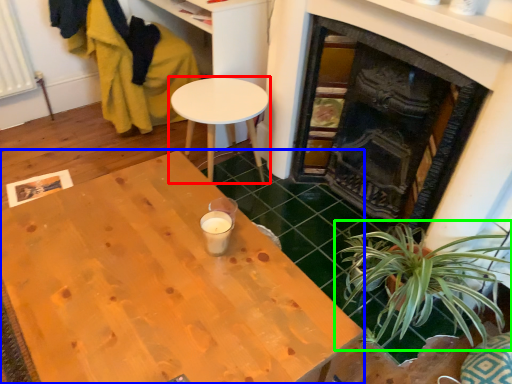
Question: Which object is positioned closest to table (highlighted by a red box)? Select from desk (highlighted by a blue box) and houseplant (highlighted by a green box).

Choices:
 (A) desk
 (B) houseplant

Answer: (A)